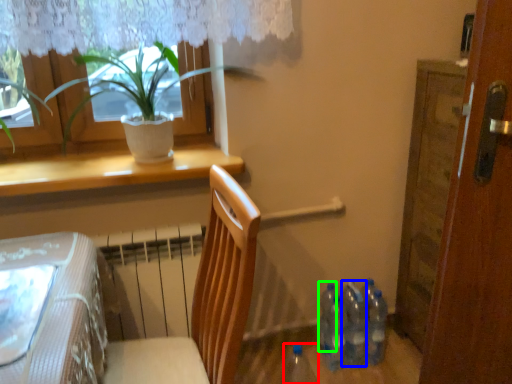
Question: Which object is positioned farthest from bottle (highlighted by a red box)? Select from bottle (highlighted by a blue box) and bottle (highlighted by a green box).

Choices:
 (A) bottle
 (B) bottle

Answer: (A)